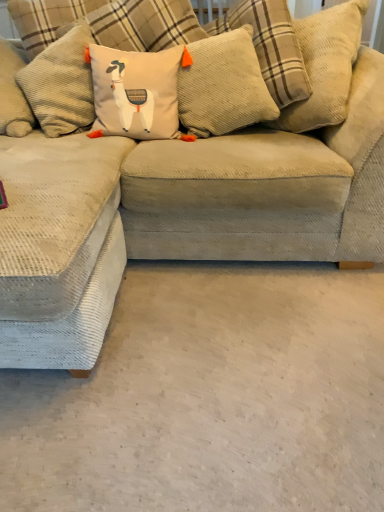
Question: Considering the relative positions of corduroy pillow at center, the 2th pillow from the right, and beige corduroy pillow with llama design at center, placed as the third pillow when sorted from right to left, in the image provided, is corduroy pillow at center, the 2th pillow from the right, behind beige corduroy pillow with llama design at center, placed as the third pillow when sorted from right to left,?

Choices:
 (A) yes
 (B) no

Answer: (A)

Question: Does corduroy pillow at center, placed as the second pillow when sorted from left to right, have a larger size compared to beige corduroy pillow with llama design at center, the first pillow when ordered from left to right?

Choices:
 (A) no
 (B) yes

Answer: (B)

Question: Can you confirm if corduroy pillow at center, the 2th pillow from the right, is shorter than beige corduroy pillow with llama design at center, the first pillow when ordered from left to right?

Choices:
 (A) yes
 (B) no

Answer: (B)

Question: Is corduroy pillow at center, the 2th pillow from the right, oriented towards beige corduroy pillow with llama design at center, the first pillow when ordered from left to right?

Choices:
 (A) yes
 (B) no

Answer: (B)

Question: Is corduroy pillow at center, placed as the second pillow when sorted from left to right, thinner than beige corduroy pillow with llama design at center, placed as the third pillow when sorted from right to left?

Choices:
 (A) no
 (B) yes

Answer: (A)

Question: Is corduroy pillow at center, arranged as the third pillow when viewed from the left, inside the boundaries of beige corduroy couch at center, or outside?

Choices:
 (A) outside
 (B) inside

Answer: (B)

Question: Is point (102, 10) positioned closer to the camera than point (279, 251)?

Choices:
 (A) closer
 (B) farther

Answer: (B)

Question: From a real-world perspective, is corduroy pillow at center, positioned as the 1th pillow in right-to-left order, positioned above or below beige corduroy couch at center?

Choices:
 (A) below
 (B) above

Answer: (B)

Question: Is corduroy pillow at center, arranged as the third pillow when viewed from the left, taller or shorter than beige corduroy couch at center?

Choices:
 (A) tall
 (B) short

Answer: (B)

Question: Based on their positions, is white carpet at lower left located to the left or right of beige corduroy pillow with llama design at center, the first pillow when ordered from left to right?

Choices:
 (A) left
 (B) right

Answer: (B)

Question: Considering the positions of white carpet at lower left and beige corduroy pillow with llama design at center, the first pillow when ordered from left to right, in the image, is white carpet at lower left bigger or smaller than beige corduroy pillow with llama design at center, the first pillow when ordered from left to right,?

Choices:
 (A) small
 (B) big

Answer: (B)

Question: From the image's perspective, relative to beige corduroy pillow with llama design at center, the first pillow when ordered from left to right, is white carpet at lower left above or below?

Choices:
 (A) above
 (B) below

Answer: (B)

Question: From a real-world perspective, relative to beige corduroy pillow with llama design at center, placed as the third pillow when sorted from right to left, is white carpet at lower left vertically above or below?

Choices:
 (A) below
 (B) above

Answer: (A)

Question: Considering their positions, is beige corduroy couch at center located in front of or behind corduroy pillow at center, the 2th pillow from the right?

Choices:
 (A) front
 (B) behind

Answer: (A)

Question: Which is correct: beige corduroy couch at center is inside corduroy pillow at center, the 2th pillow from the right, or outside of it?

Choices:
 (A) inside
 (B) outside

Answer: (B)